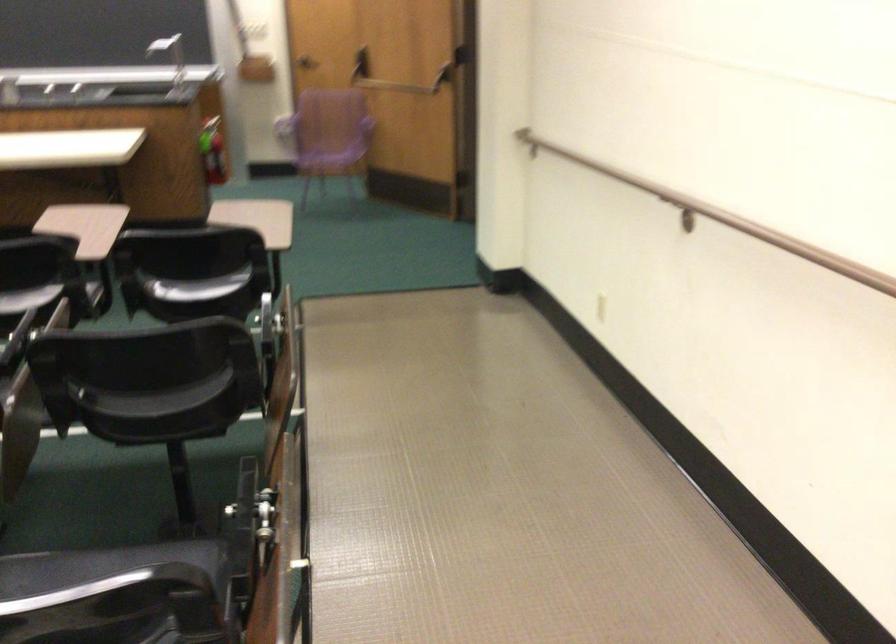
The height and width of the screenshot is (644, 896). What do you see at coordinates (444, 78) in the screenshot?
I see `a door push bar` at bounding box center [444, 78].